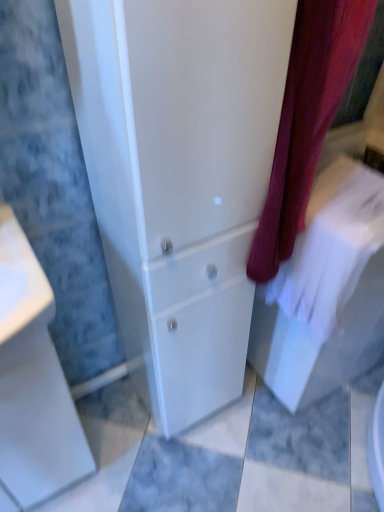
I want to click on vacant space to the right of white glossy porcelain at lower left, so click(116, 457).